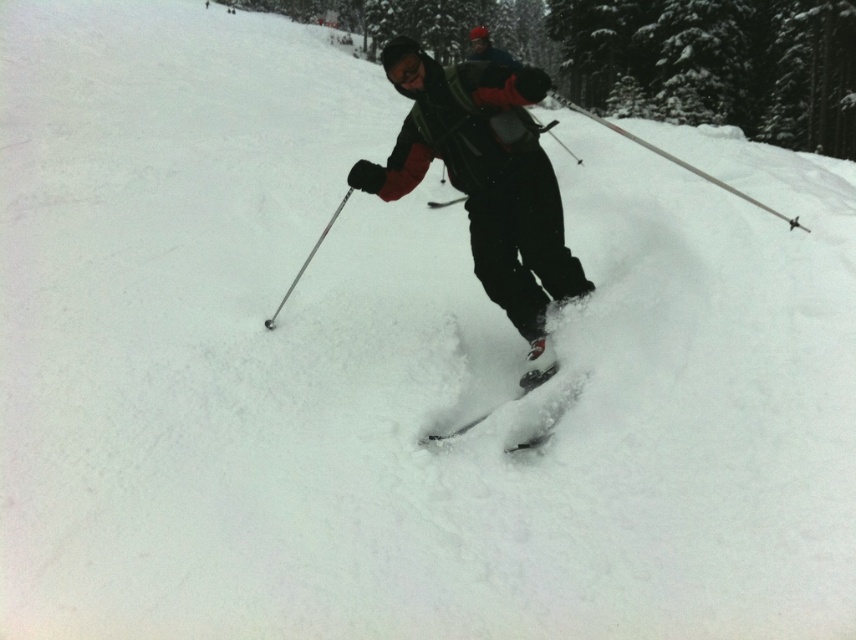
Between green textured tree at center and metallic silver ski pole at center, which one is positioned higher?

green textured tree at center

Does green textured tree at center lie in front of metallic silver ski pole at center?

No, it is behind metallic silver ski pole at center.

Who is more distant from viewer, (578, 42) or (268, 326)?

Point (578, 42)

I want to click on green textured tree at center, so click(651, 54).

Who is shorter, green textured tree at center or matte black ski suit at center?

matte black ski suit at center is shorter.

Measure the distance between green textured tree at center and matte black ski suit at center.

A distance of 18.10 meters exists between green textured tree at center and matte black ski suit at center.

In order to click on green textured tree at center in this screenshot , I will do `click(651, 54)`.

Can you confirm if matte black ski suit at center is shorter than shiny black ski at center?

In fact, matte black ski suit at center may be taller than shiny black ski at center.

Between matte black ski suit at center and shiny black ski at center, which one is positioned lower?

shiny black ski at center

Does point (506, 208) lie behind point (519, 385)?

No.

Where is `matte black ski suit at center`? matte black ski suit at center is located at coordinates (485, 179).